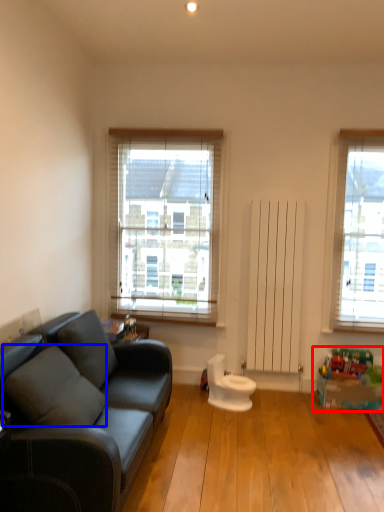
Question: Which object appears closest to the camera in this image, toy (highlighted by a red box) or pillow (highlighted by a blue box)?

Choices:
 (A) toy
 (B) pillow

Answer: (B)